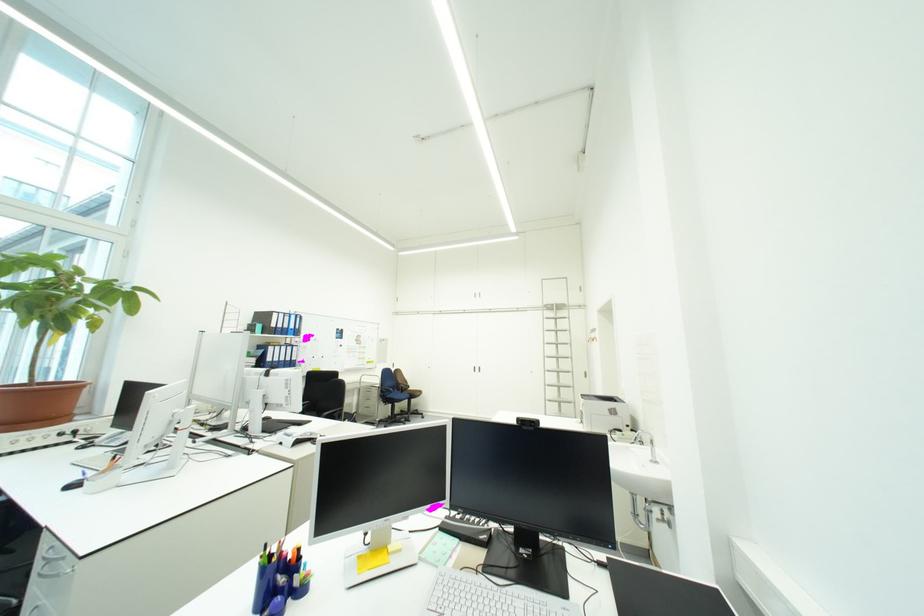
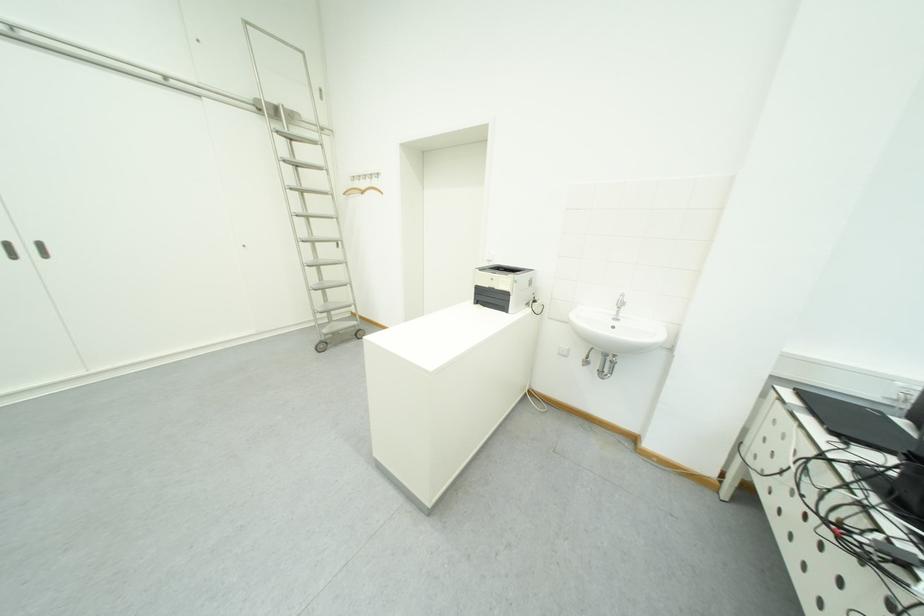
Find the pixel in the second image that matches point (572, 355) in the first image.

(322, 213)